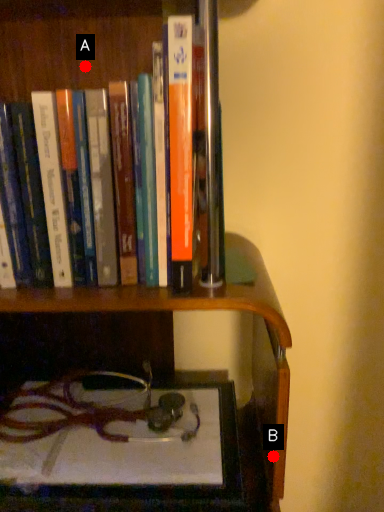
Question: Two points are circled on the image, labeled by A and B beside each circle. Which of the following is the closest to the observer?

Choices:
 (A) A is closer
 (B) B is closer

Answer: (B)